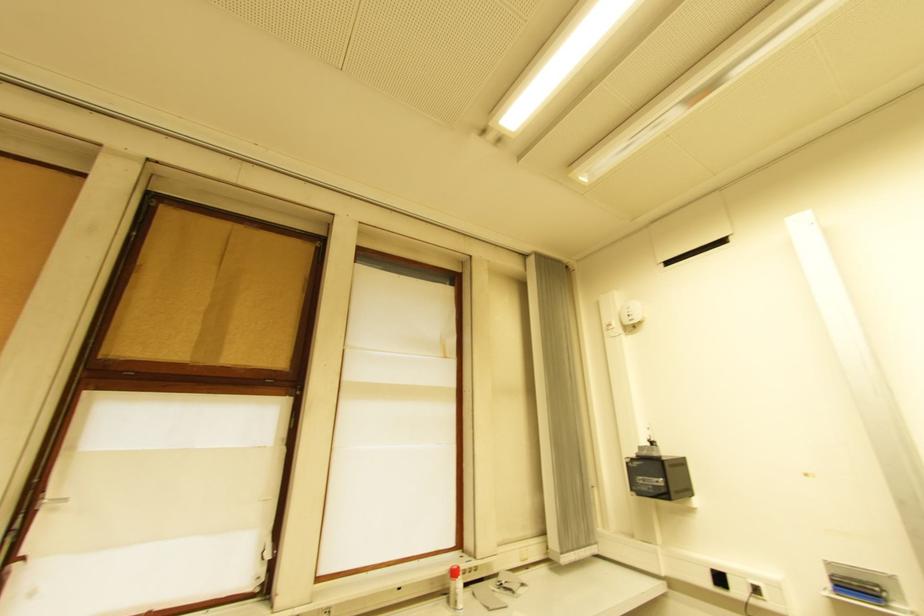
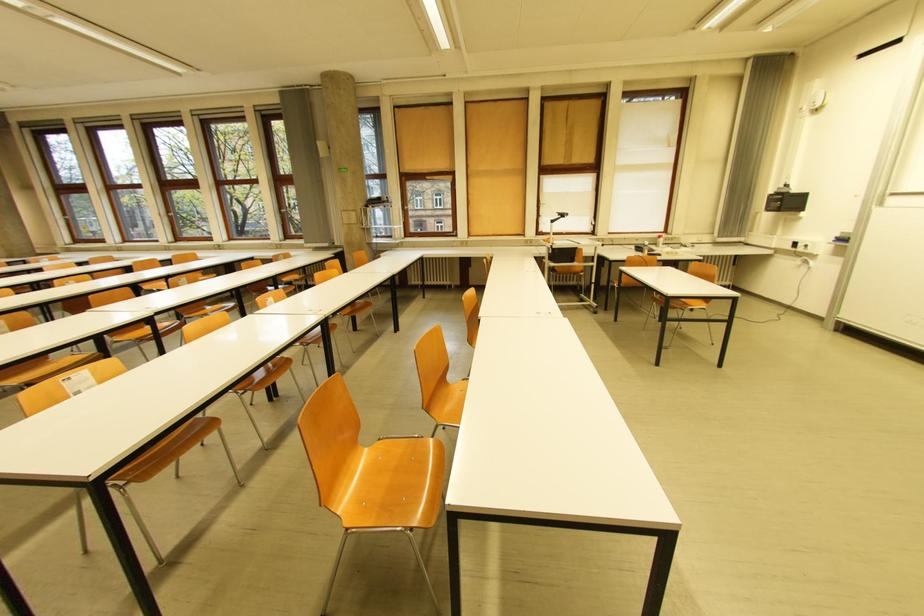
Locate, in the second image, the point that corresponds to pixel 453 359 in the first image.

(676, 148)